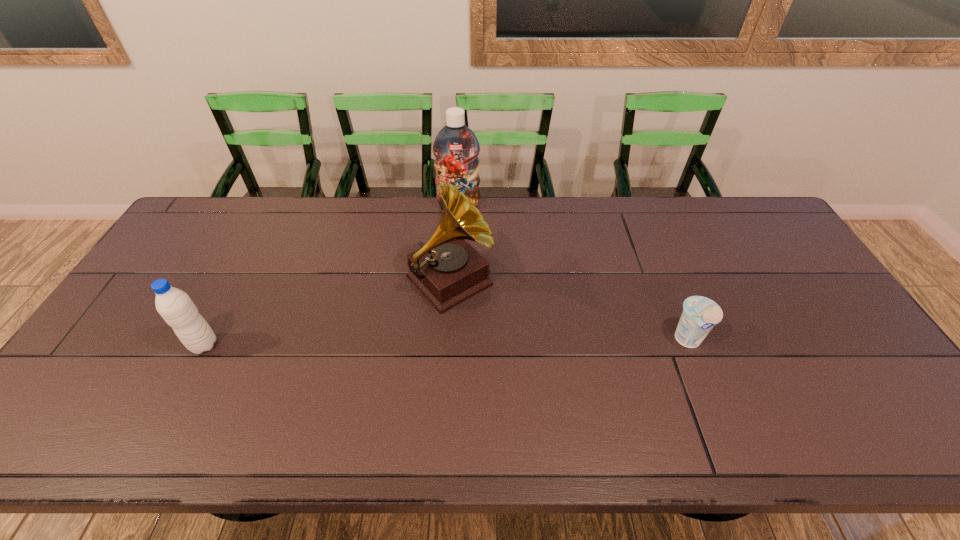
Identify the location of blank space located from the horn of the phonograph record. (502, 335).

Find the location of a particular element. free region located on the front label of the farthest object is located at coordinates (461, 224).

At what (x,y) coordinates should I click in order to perform the action: click on vacant space located 0.300m on the front label of the farthest object. Please return your answer as a coordinate pair (x, y). Image resolution: width=960 pixels, height=540 pixels. Looking at the image, I should click on (465, 274).

This screenshot has width=960, height=540. What are the coordinates of `vacant area situated 0.150m on the front label of the farthest object` in the screenshot? It's located at (462, 241).

At what (x,y) coordinates should I click in order to perform the action: click on object that is positioned at the far edge. Please return your answer as a coordinate pair (x, y). The image size is (960, 540). Looking at the image, I should click on (456, 148).

This screenshot has width=960, height=540. Identify the location of free location at the far edge. (403, 212).

You are a GUI agent. You are given a task and a screenshot of the screen. Output one action in this format:
    pyautogui.click(x=<x>, y=<y>)
    Task: Click on the blank space at the near edge of the desktop
    This screenshot has width=960, height=540.
    Given the screenshot: What is the action you would take?
    (x=348, y=407)

Identify the location of vacant space at the right edge of the desktop. Image resolution: width=960 pixels, height=540 pixels. (813, 317).

I want to click on vacant space at the far left corner of the desktop, so click(x=233, y=202).

This screenshot has height=540, width=960. I want to click on vacant region at the far right corner of the desktop, so click(x=716, y=202).